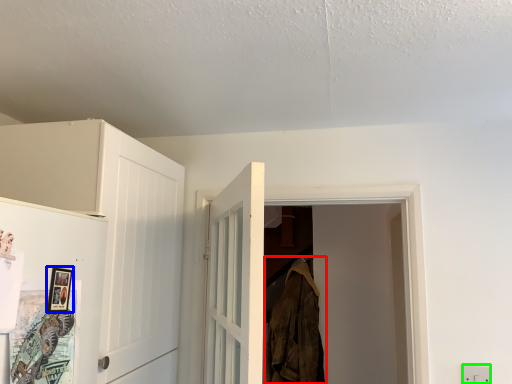
Question: Estimate the real-world distances between objects in this image. Which object is closer to clothing (highlighted by a red box), picture frame (highlighted by a blue box) or electric outlet (highlighted by a green box)?

Choices:
 (A) picture frame
 (B) electric outlet

Answer: (B)